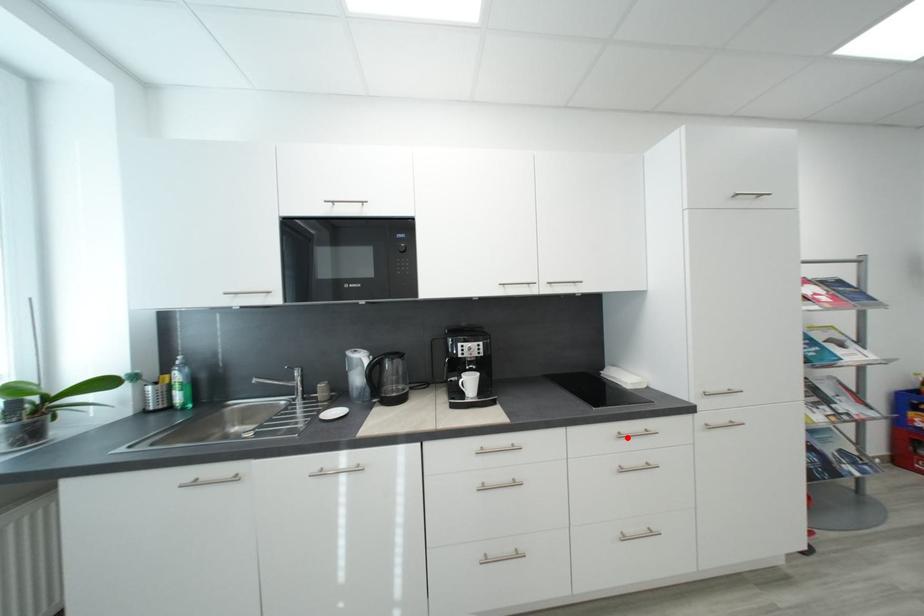
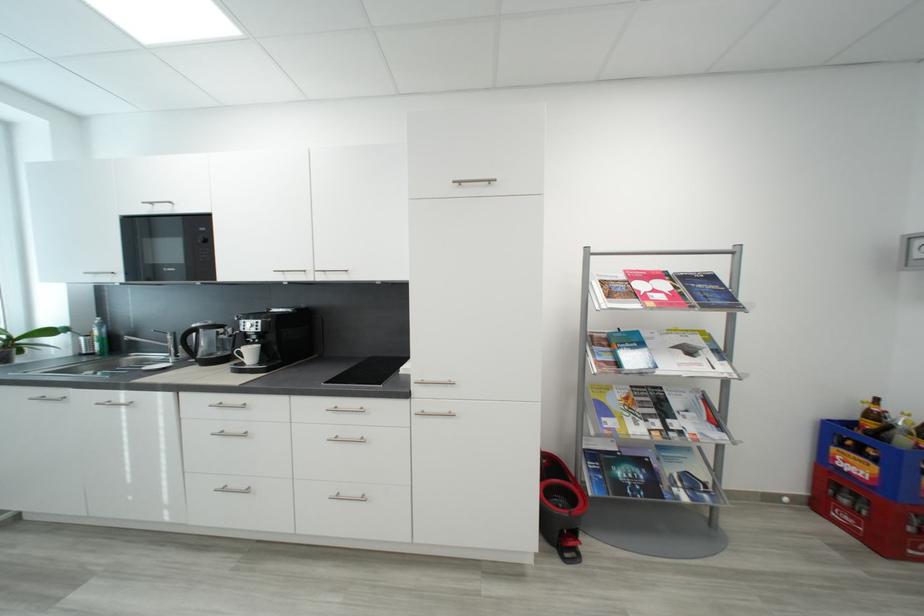
In the second image, find the point that corresponds to the highlighted location in the first image.

(343, 411)